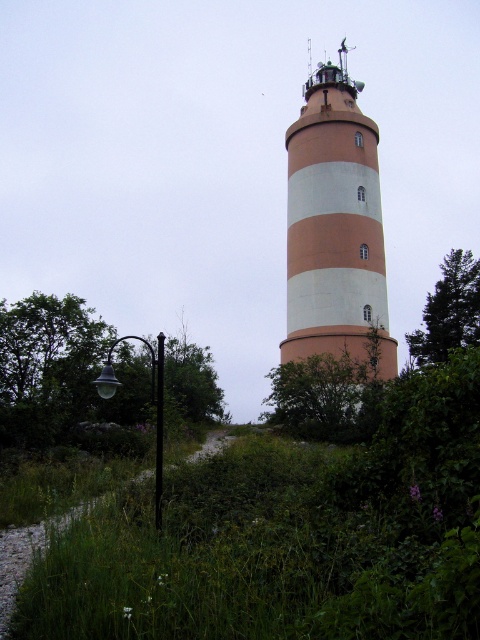
You are standing at the base of the lighthouse and see the green leafy tree at lower left and the green leafy tree at right. Which tree is located more to the left side?

The green leafy tree at lower left is positioned on the left side of the green leafy tree at right, so the green leafy tree at lower left is more to the left.

You are standing at the base of the lighthouse and looking towards the top. There is a point marked at coordinates point (64, 374). What object is located at this point?

The point (64, 374) corresponds to the green leafy tree at lower left.

From the picture: You are standing at the base of the lighthouse and want to take a photo of the lighthouse with the green leafy tree at lower left in the background. Based on its position, will the tree be visible in the photo if you frame the lighthouse centrally?

The green leafy tree at lower left is located at point [64,374], which places it outside the central framing of the lighthouse. Therefore, the tree will not be visible in the photo if you frame the lighthouse centrally.